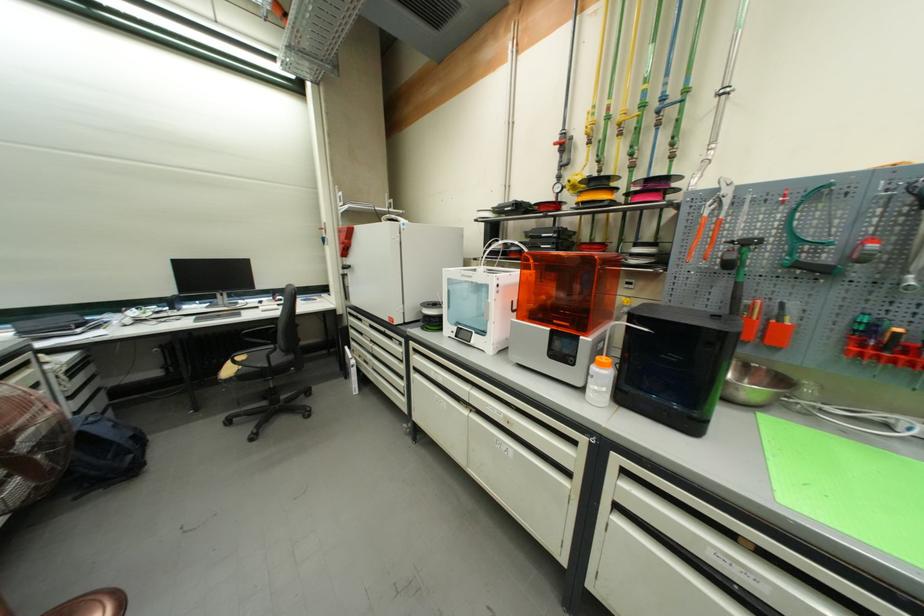
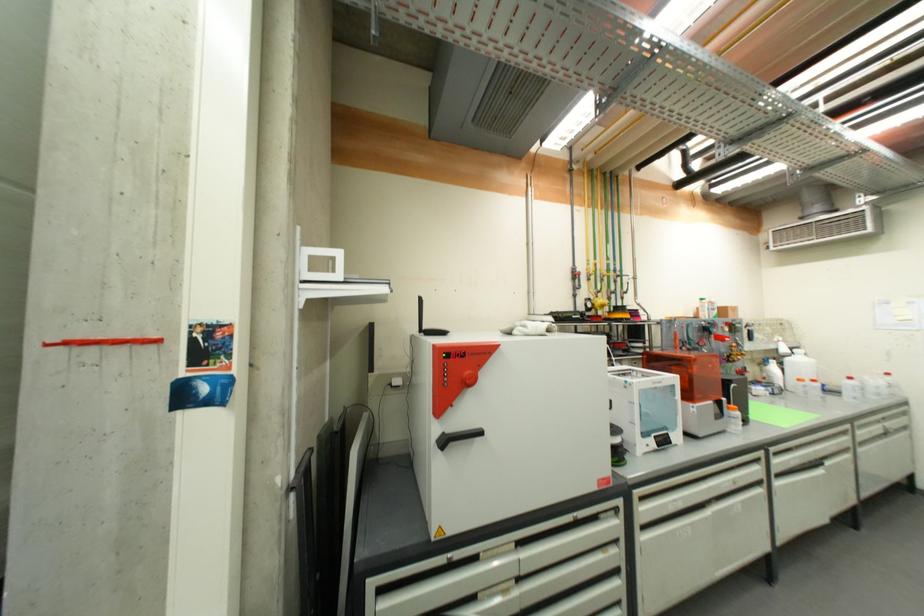
Where in the second image is the point corresponding to the point at 377,328 from the first image?

(525, 546)